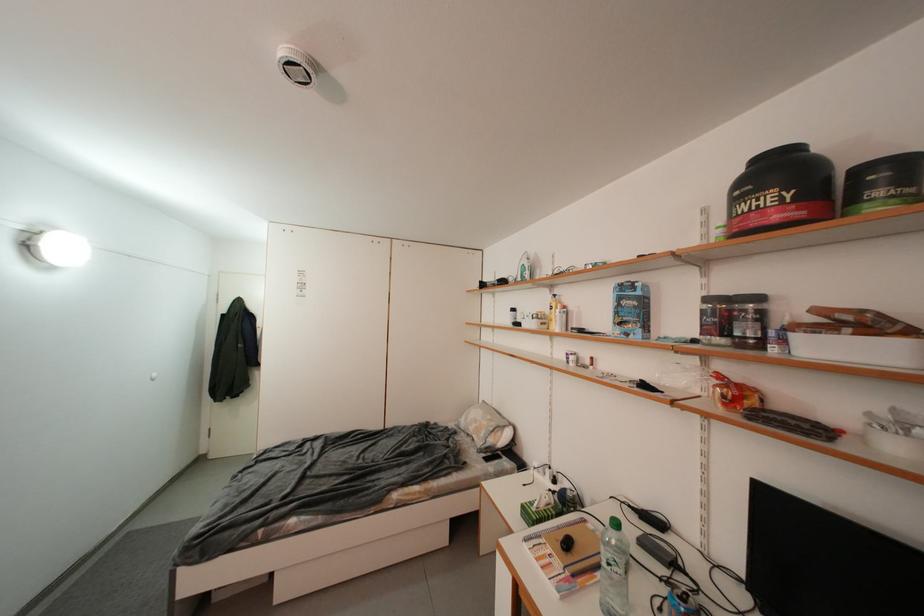
This screenshot has width=924, height=616. I want to click on white cabinet handle, so click(x=152, y=376).